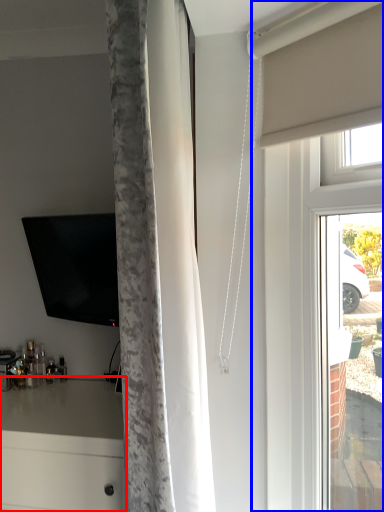
Question: Which of the following is the closest to the observer, counter (highlighted by a red box) or glass door (highlighted by a blue box)?

Choices:
 (A) counter
 (B) glass door

Answer: (B)